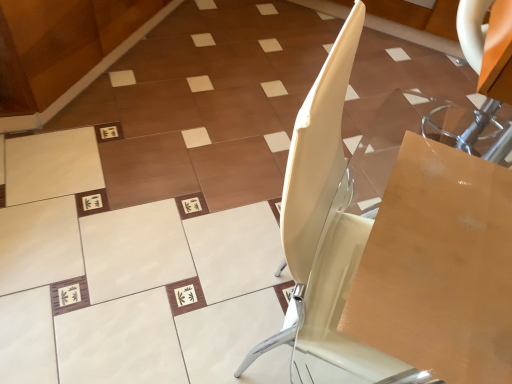
Question: Considering their positions, is white glossy chair at center located in front of or behind wooden cardboard box at center-right?

Choices:
 (A) front
 (B) behind

Answer: (A)

Question: From a real-world perspective, relative to wooden cardboard box at center-right, is white glossy chair at center vertically above or below?

Choices:
 (A) below
 (B) above

Answer: (A)

Question: Which object is the closest to the white glossy chair at center?

Choices:
 (A) wooden cardboard box at center-right
 (B) transparent acrylic table at upper right

Answer: (A)

Question: Which object is the farthest from the transparent acrylic table at upper right?

Choices:
 (A) white glossy chair at center
 (B) wooden cardboard box at center-right

Answer: (B)